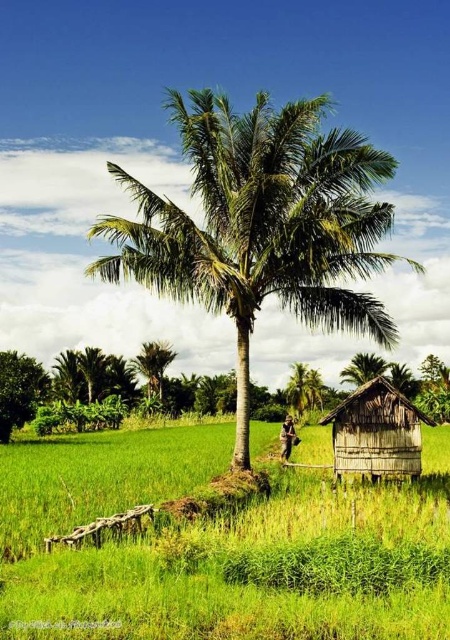
You are a farmer standing at the wooden hut at lower right and want to water the green leafy coconut tree at center. If your watering can holds enough water for a round trip of 10 meters, can you reach the tree without needing to refill?

The distance between the green leafy coconut tree at center and the wooden hut at lower right is 5.35 meters. Since the round trip would be 10.7 meters, which exceeds the watering can capacity for 10 meters, you would need to refill before returning.

You are planning to plant a new row of rice plants in the green grassy rice field at lower left. Considering the space available, will the green leafy coconut tree at center interfere with the growth of the new row?

The green grassy rice field at lower left has a larger width than the green leafy coconut tree at center, so there is sufficient space to plant a new row without interference from the tree.

Consider the image. You are standing in the rural landscape and want to determine which of the two points, point [59,445] or point [265,180], is closer to you. Based on the scene, which point is nearer?

Point [59,445] is closer to you than point [265,180] because it is further to the viewer according to the description.